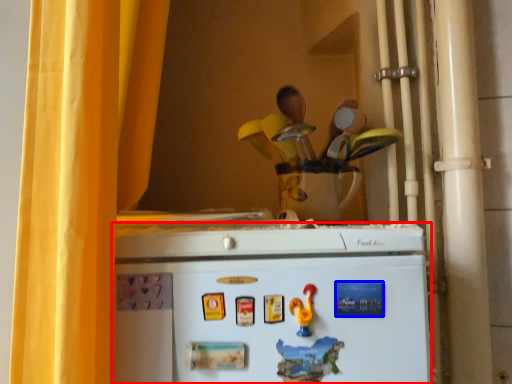
Question: Which object is closer to the camera taking this photo, refrigerator (highlighted by a red box) or magnet (highlighted by a blue box)?

Choices:
 (A) refrigerator
 (B) magnet

Answer: (A)